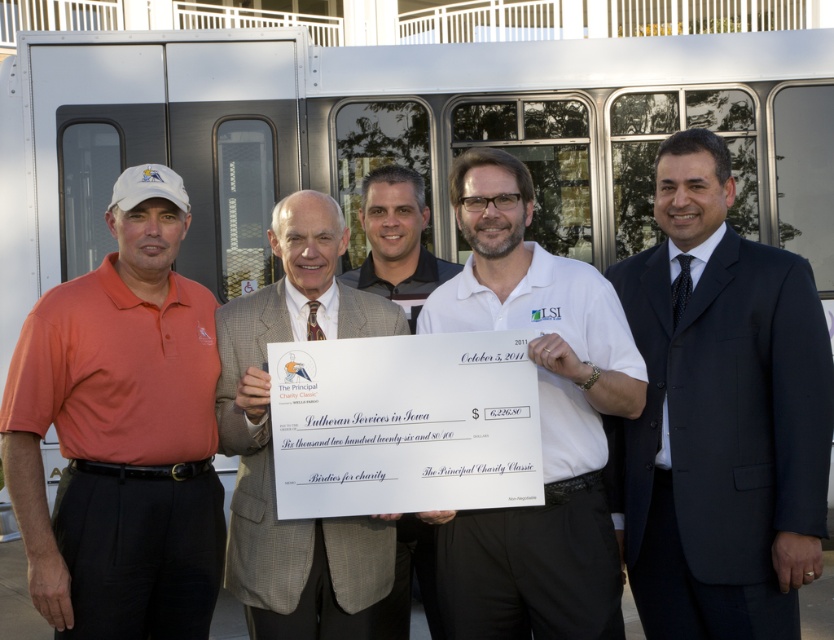
Question: Considering the real-world distances, which object is farthest from the dark blue suit at center?

Choices:
 (A) orange matte shirt at left
 (B) white shirt at center

Answer: (A)

Question: Is dark blue suit at center to the right of white cotton shirt at center from the viewer's perspective?

Choices:
 (A) yes
 (B) no

Answer: (A)

Question: Which point appears farthest from the camera in this image?

Choices:
 (A) (398, 568)
 (B) (147, 371)
 (C) (817, 385)

Answer: (A)

Question: Observing the image, what is the correct spatial positioning of white cotton shirt at center in reference to white shirt at center?

Choices:
 (A) above
 (B) below

Answer: (B)

Question: Which point appears farthest from the camera in this image?

Choices:
 (A) (214, 364)
 (B) (757, 296)
 (C) (270, 579)
 (D) (611, 600)

Answer: (A)

Question: Is orange matte shirt at left to the left of white cotton shirt at center from the viewer's perspective?

Choices:
 (A) yes
 (B) no

Answer: (A)